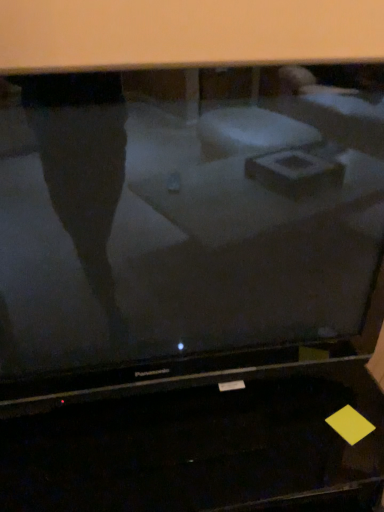
Locate an element on the screen. The height and width of the screenshot is (512, 384). matte black television at center is located at coordinates (181, 237).

The height and width of the screenshot is (512, 384). What do you see at coordinates (181, 237) in the screenshot?
I see `matte black television at center` at bounding box center [181, 237].

Describe the element at coordinates (197, 445) in the screenshot. I see `black glossy desktop at lower center` at that location.

Measure the distance between black glossy desktop at lower center and camera.

81.26 centimeters.

Where is `black glossy desktop at lower center`? black glossy desktop at lower center is located at coordinates (197, 445).

You are a GUI agent. You are given a task and a screenshot of the screen. Output one action in this format:
    pyautogui.click(x=<x>, y=<y>)
    Task: Click on the matte black television at center
    This screenshot has height=512, width=384.
    Given the screenshot: What is the action you would take?
    pyautogui.click(x=181, y=237)

Can you confirm if black glossy desktop at lower center is positioned to the left of matte black television at center?

Yes.

Is the depth of black glossy desktop at lower center greater than that of matte black television at center?

Yes.

Is point (293, 428) positioned before point (43, 167)?

No, it is behind (43, 167).

From the image's perspective, which is below, black glossy desktop at lower center or matte black television at center?

black glossy desktop at lower center is shown below in the image.

From a real-world perspective, relative to matte black television at center, is black glossy desktop at lower center vertically above or below?

black glossy desktop at lower center is situated lower than matte black television at center in the real world.

Considering the sizes of black glossy desktop at lower center and matte black television at center in the image, is black glossy desktop at lower center wider or thinner than matte black television at center?

In the image, black glossy desktop at lower center appears to be wider than matte black television at center.

Who is shorter, black glossy desktop at lower center or matte black television at center?

black glossy desktop at lower center is shorter.

Is black glossy desktop at lower center bigger or smaller than matte black television at center?

black glossy desktop at lower center is bigger than matte black television at center.

Do you think black glossy desktop at lower center is within matte black television at center, or outside of it?

black glossy desktop at lower center is outside matte black television at center.

Are black glossy desktop at lower center and matte black television at center making contact?

No, black glossy desktop at lower center is not beside matte black television at center.

Is black glossy desktop at lower center positioned with its back to matte black television at center?

No, black glossy desktop at lower center's orientation is not away from matte black television at center.

How many degrees apart are the facing directions of black glossy desktop at lower center and matte black television at center?

They differ by 1.65 degrees in their facing directions.

What are the coordinates of `television that appears in front of the black glossy desktop at lower center` in the screenshot? It's located at (181, 237).

Which is more to the right, matte black television at center or black glossy desktop at lower center?

Positioned to the right is matte black television at center.

Which object is further away from the camera taking this photo, matte black television at center or black glossy desktop at lower center?

black glossy desktop at lower center is further away from the camera.

Which is more distant, [78,329] or [286,375]?

The point [286,375] is farther.

From the image's perspective, which is above, matte black television at center or black glossy desktop at lower center?

matte black television at center is shown above in the image.

From a real-world perspective, is matte black television at center over black glossy desktop at lower center?

Yes.

Between matte black television at center and black glossy desktop at lower center, which one has smaller width?

With smaller width is matte black television at center.

Considering the sizes of objects matte black television at center and black glossy desktop at lower center in the image provided, who is taller, matte black television at center or black glossy desktop at lower center?

With more height is matte black television at center.

Between matte black television at center and black glossy desktop at lower center, which one has smaller size?

matte black television at center is smaller.

Is matte black television at center not within black glossy desktop at lower center?

Absolutely, matte black television at center is external to black glossy desktop at lower center.

Is matte black television at center positioned far away from black glossy desktop at lower center?

No, matte black television at center is not far from black glossy desktop at lower center.

Could you tell me if matte black television at center is facing black glossy desktop at lower center?

No, matte black television at center is not facing towards black glossy desktop at lower center.

Find the location of a particular element. television above the black glossy desktop at lower center (from a real-world perspective) is located at coordinates (181, 237).

Image resolution: width=384 pixels, height=512 pixels. In the image, there is a black glossy desktop at lower center. In order to click on television above it (from the image's perspective) in this screenshot , I will do `click(181, 237)`.

You are a GUI agent. You are given a task and a screenshot of the screen. Output one action in this format:
    pyautogui.click(x=<x>, y=<y>)
    Task: Click on the desktop located behind the matte black television at center
    Image resolution: width=384 pixels, height=512 pixels.
    Given the screenshot: What is the action you would take?
    pyautogui.click(x=197, y=445)